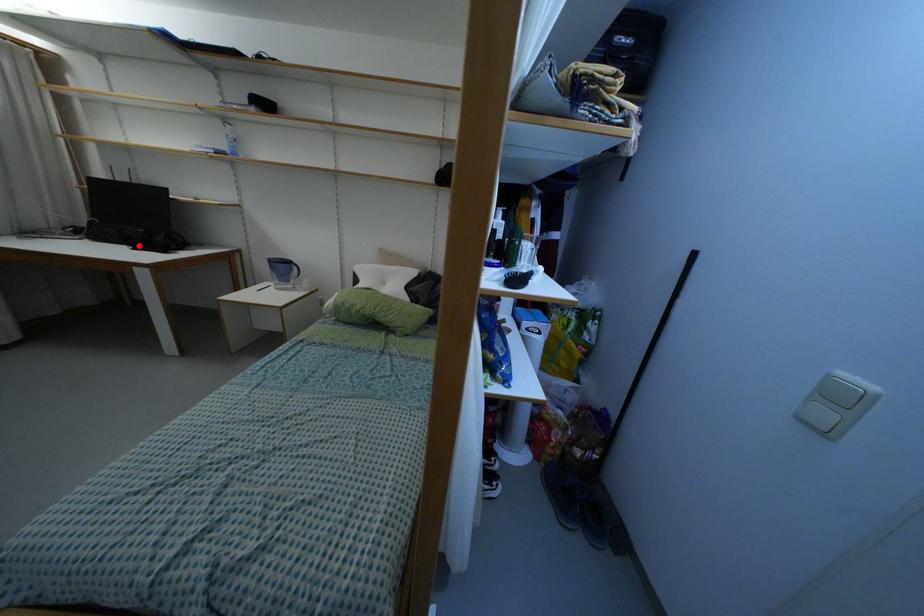
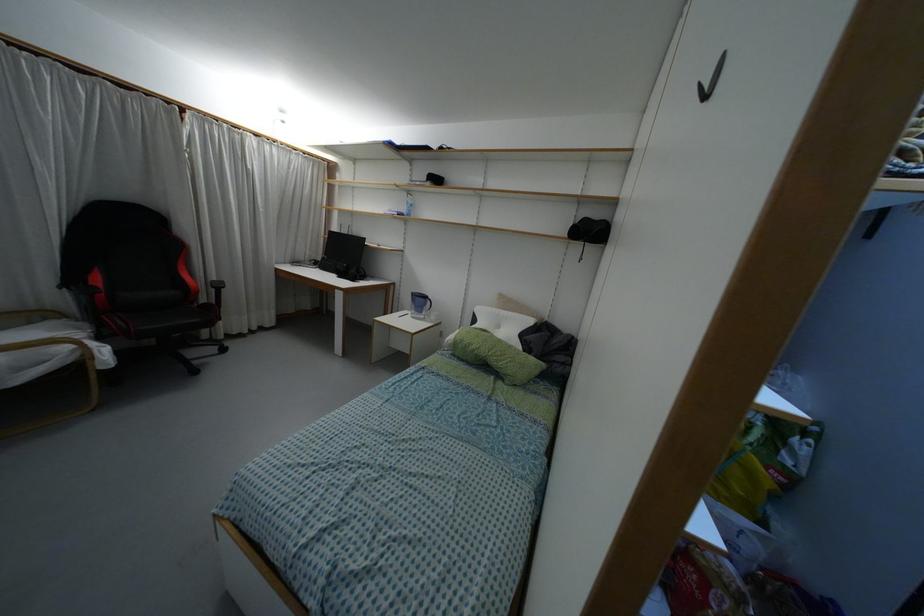
In the second image, find the point that corresponds to the highlighted location in the first image.

(341, 275)